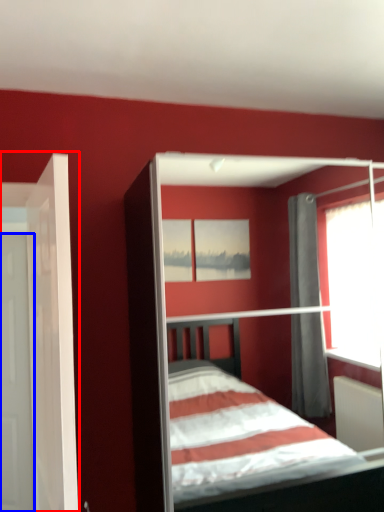
Question: Among these objects, which one is nearest to the camera, door (highlighted by a red box) or door (highlighted by a blue box)?

Choices:
 (A) door
 (B) door

Answer: (A)